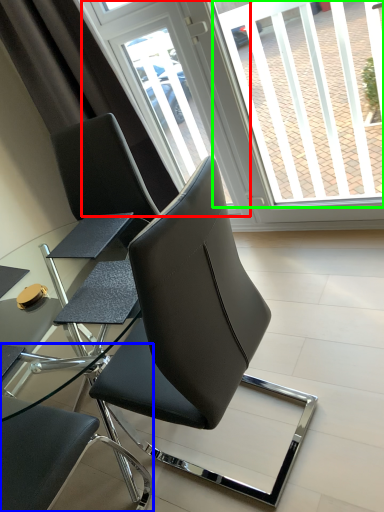
Question: Based on their relative distances, which object is farther from screen door (highlighted by a red box)? Choose from chair (highlighted by a blue box) and window screen (highlighted by a green box).

Choices:
 (A) chair
 (B) window screen

Answer: (A)